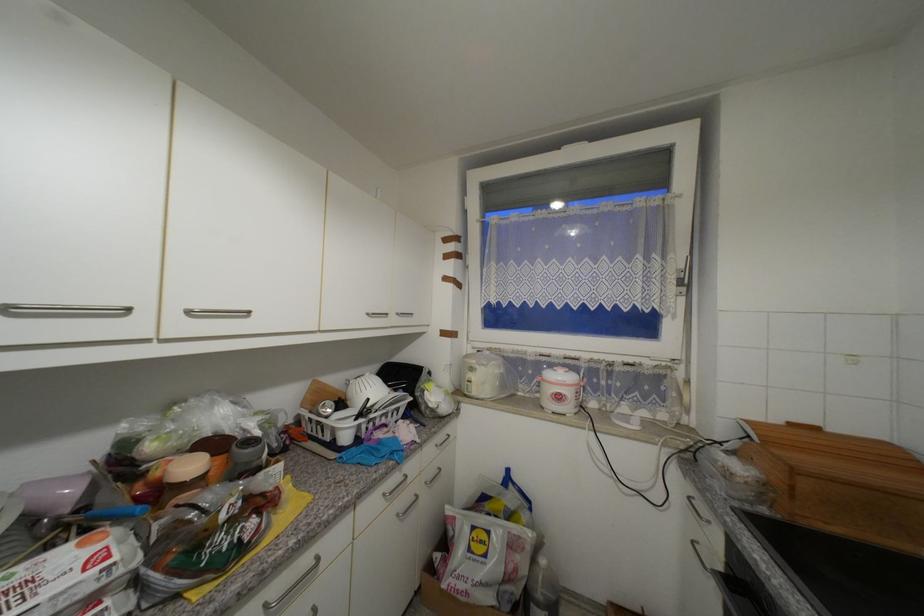
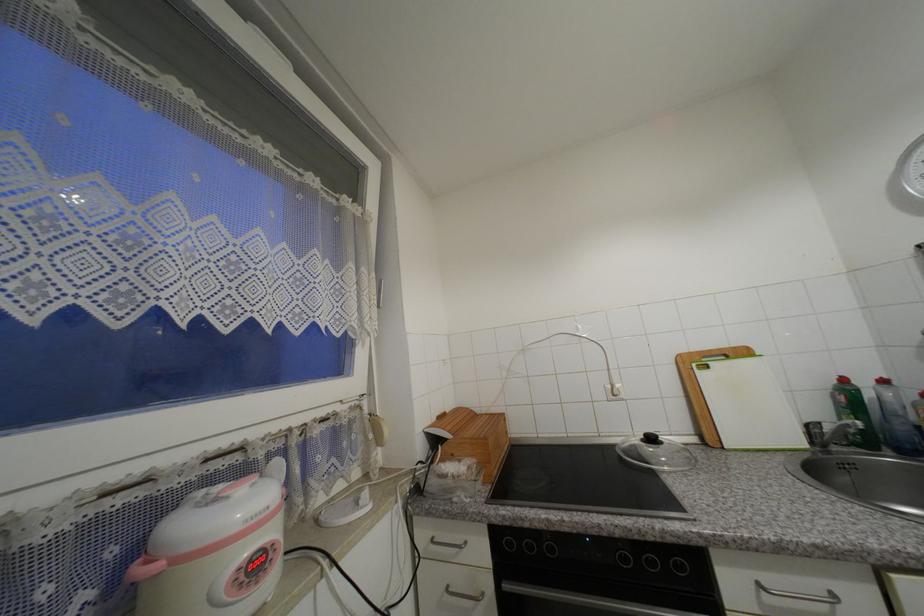
Question: How did the camera likely rotate?

Choices:
 (A) Left
 (B) Right
 (C) Up
 (D) Down

Answer: (B)